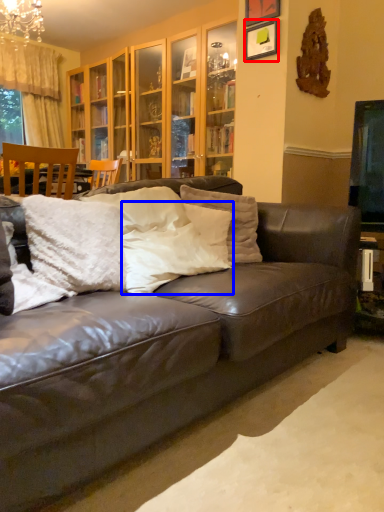
Question: Which point is further to the camera, picture frame (highlighted by a red box) or pillow (highlighted by a blue box)?

Choices:
 (A) picture frame
 (B) pillow

Answer: (A)